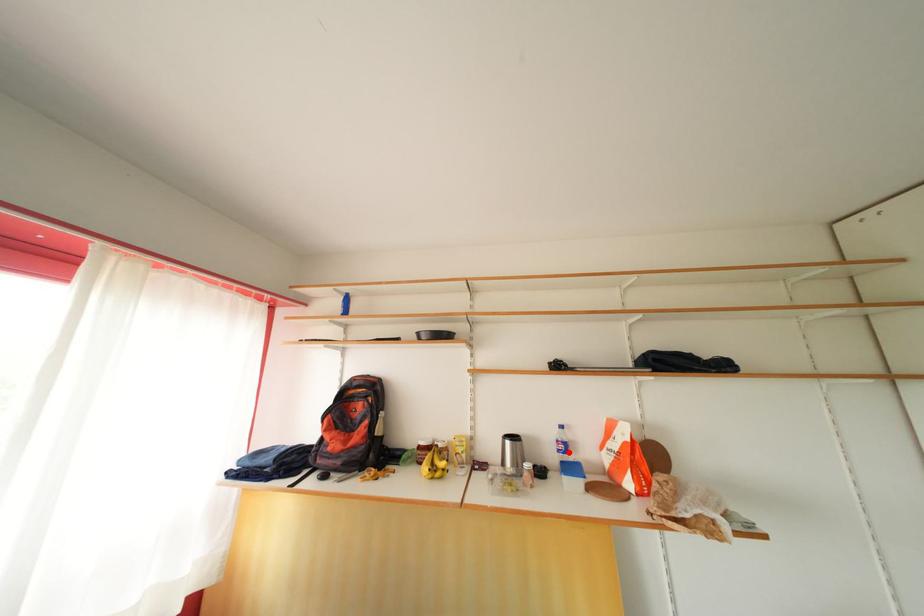
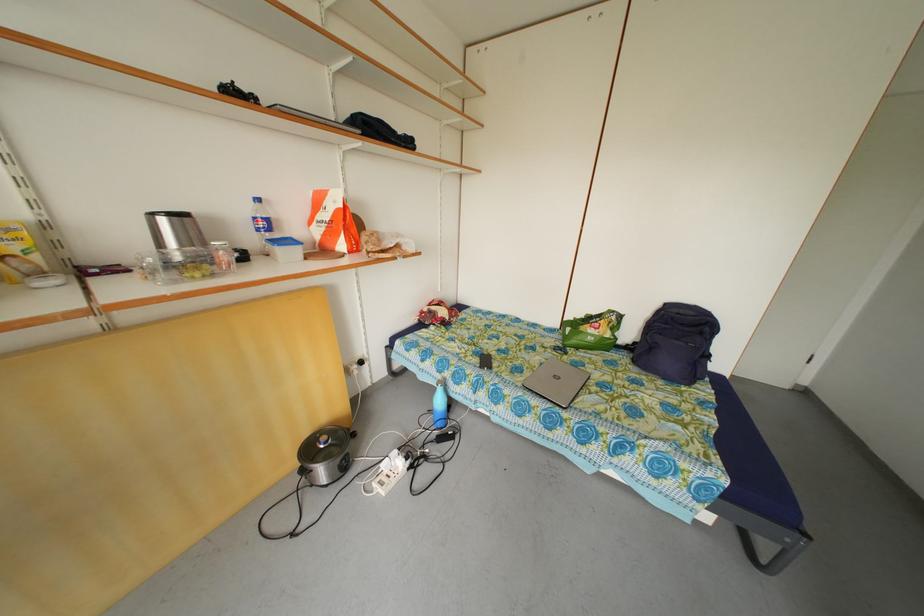
Question: I am providing you with two images of the same scene from different viewpoints. A red point is shown in image1. For the corresponding object point in image2, is it positioned nearer or farther from the camera?

Choices:
 (A) Nearer
 (B) Farther

Answer: (A)